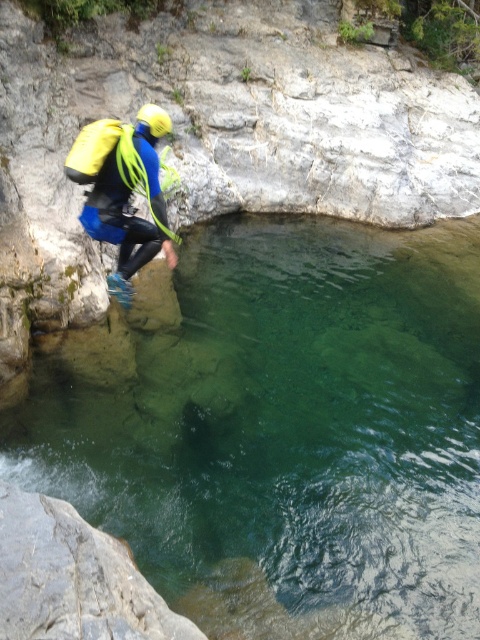
Based on the coordinates provided, what is the object located at point (72, 579) in the scene?

The object at point (72, 579) is the gray rough rock at lower left.